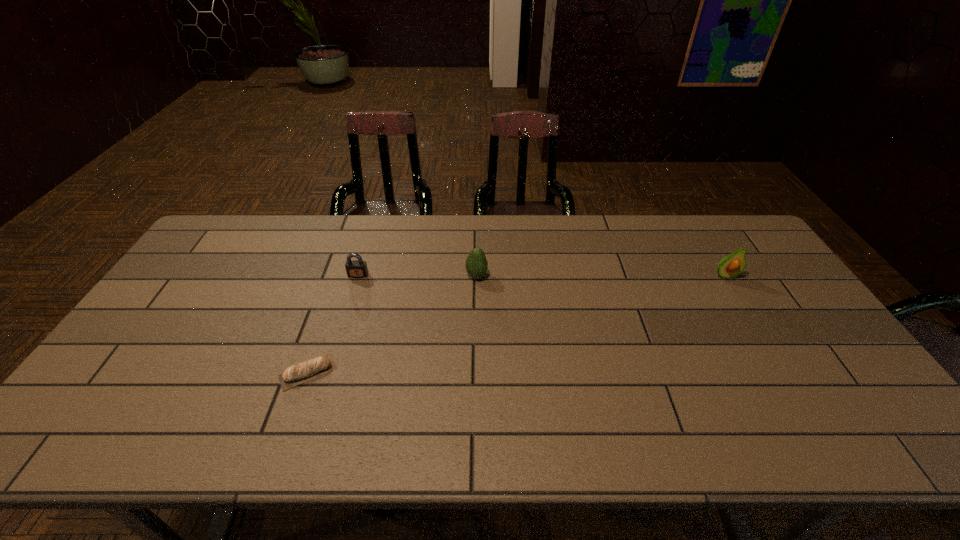
This screenshot has width=960, height=540. What are the coordinates of `vacant area that lies between the second shortest object and the nearest object` in the screenshot? It's located at (333, 323).

Find the location of a particular element. vacant space in between the nearest object and the rightmost object is located at coordinates (516, 324).

The height and width of the screenshot is (540, 960). I want to click on vacant area that lies between the second shortest object and the second object from right to left, so click(x=418, y=275).

This screenshot has width=960, height=540. I want to click on vacant area that lies between the second object from right to left and the rightmost object, so click(601, 276).

You are a GUI agent. You are given a task and a screenshot of the screen. Output one action in this format:
    pyautogui.click(x=<x>, y=<y>)
    Task: Click on the object that is the closest to the pita bread
    
    Given the screenshot: What is the action you would take?
    pyautogui.click(x=358, y=268)

Identify the location of object that stands as the third closest to the right avocado. (294, 375).

What are the coordinates of `vacant space that satisfies the following two spatial constraints: 1. on the front of the second shortest object near the keyhole; 2. on the left side of the left avocado` in the screenshot? It's located at (358, 276).